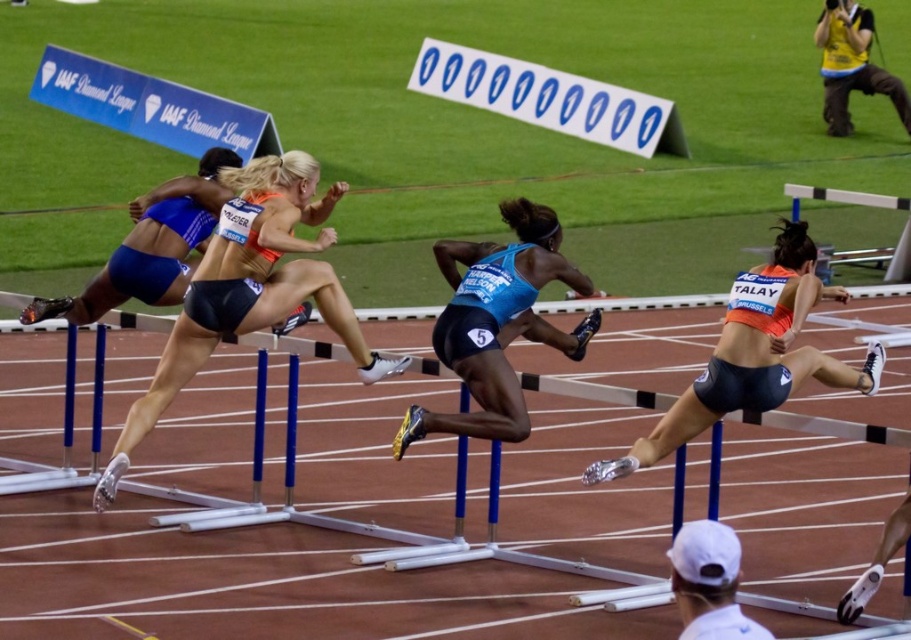
Which of these two, matte black shorts at center or yellow fabric camera at upper right, stands shorter?

yellow fabric camera at upper right

Is point (288, 252) positioned after point (846, 12)?

No, (288, 252) is closer to viewer.

You are a GUI agent. You are given a task and a screenshot of the screen. Output one action in this format:
    pyautogui.click(x=<x>, y=<y>)
    Task: Click on the matte black shorts at center
    
    Given the screenshot: What is the action you would take?
    pyautogui.click(x=251, y=289)

Can you confirm if blue plastic hurdle at center is thinner than blue matte running shorts at center?

Correct, blue plastic hurdle at center's width is less than blue matte running shorts at center's.

Who is shorter, blue plastic hurdle at center or blue matte running shorts at center?

Standing shorter between the two is blue plastic hurdle at center.

At what (x,y) coordinates should I click in order to perform the action: click on blue plastic hurdle at center. Please return your answer as a coordinate pair (x, y). The height and width of the screenshot is (640, 911). Looking at the image, I should click on (374, 522).

Find the location of `blue plastic hurdle at center`. blue plastic hurdle at center is located at coordinates (374, 522).

Between point (640, 138) and point (833, 72), which one is positioned behind?

Point (833, 72)

Is white plastic finish line at upper center wider than yellow fabric camera at upper right?

No, white plastic finish line at upper center is not wider than yellow fabric camera at upper right.

Where is `white plastic finish line at upper center`? The height and width of the screenshot is (640, 911). white plastic finish line at upper center is located at coordinates [549, 99].